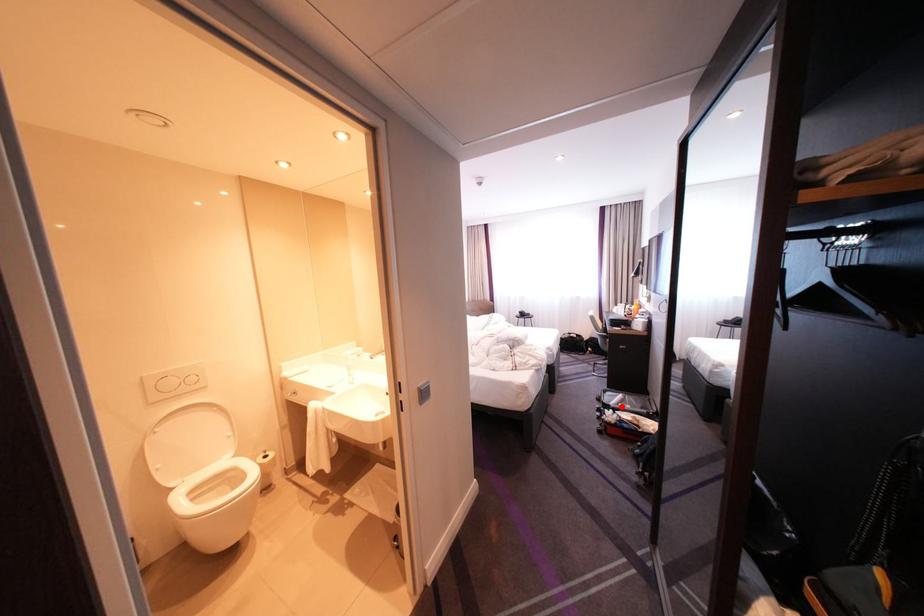
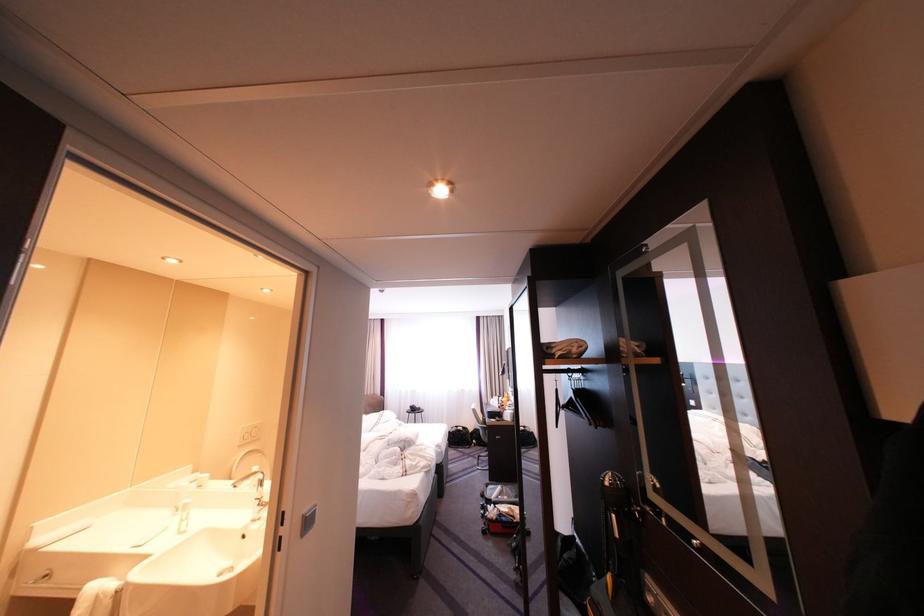
Question: I am providing you with two images of the same scene from different viewpoints. A red point is marked on the first image. At the location where the point appears in image 1, is it still visible in image 2?

Choices:
 (A) Yes
 (B) No

Answer: (A)